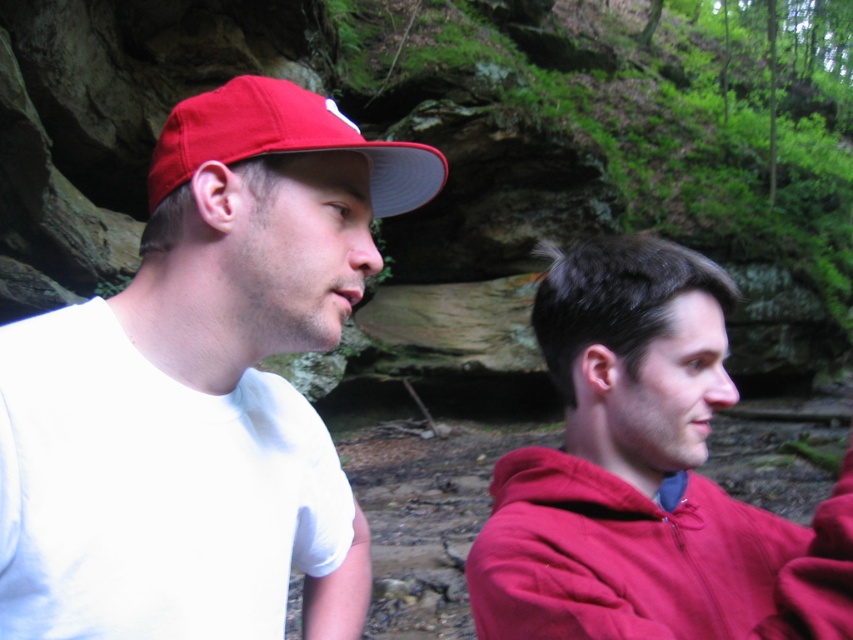
Question: Is the position of matte red sweatshirt at right less distant than that of matte red baseball cap at left?

Choices:
 (A) no
 (B) yes

Answer: (B)

Question: Considering the relative positions of white matte t-shirt at left and matte red sweatshirt at right in the image provided, where is white matte t-shirt at left located with respect to matte red sweatshirt at right?

Choices:
 (A) right
 (B) left

Answer: (B)

Question: Which object is positioned farthest from the matte red baseball cap at left?

Choices:
 (A) white matte t-shirt at left
 (B) matte red sweatshirt at right

Answer: (B)

Question: Is white matte t-shirt at left closer to camera compared to matte red sweatshirt at right?

Choices:
 (A) no
 (B) yes

Answer: (B)

Question: Among these objects, which one is farthest from the camera?

Choices:
 (A) matte red baseball cap at left
 (B) white matte t-shirt at left

Answer: (A)

Question: Which object is the farthest from the matte red sweatshirt at right?

Choices:
 (A) matte red baseball cap at left
 (B) matte red hoodie at right

Answer: (A)